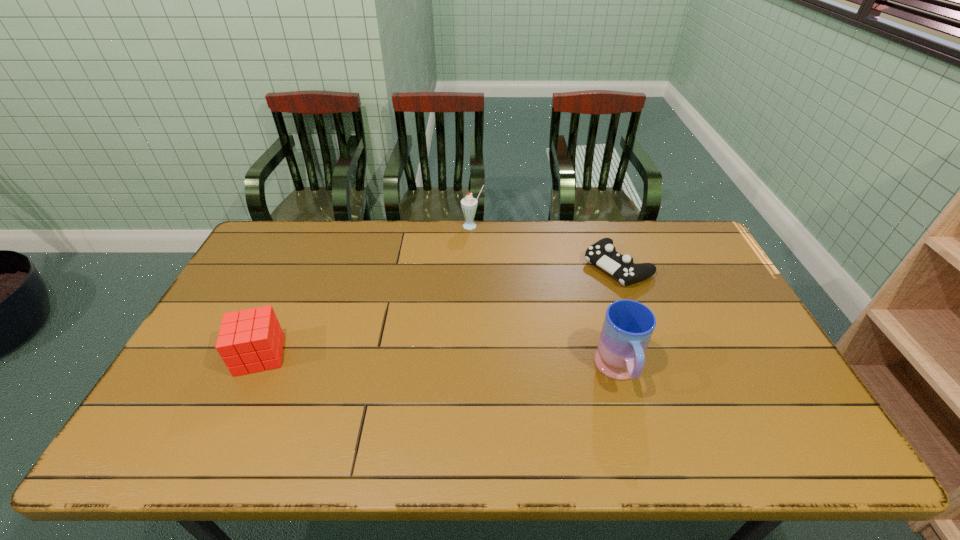
The width and height of the screenshot is (960, 540). I want to click on the leftmost object, so click(x=249, y=341).

What are the coordinates of `cube` in the screenshot? It's located at (249, 341).

Locate an element on the screen. mug is located at coordinates (628, 325).

The image size is (960, 540). In order to click on the shortest object in this screenshot , I will do 602,253.

What are the coordinates of `control` in the screenshot? It's located at (602, 253).

Where is `the farthest object`? the farthest object is located at coordinates (469, 204).

The height and width of the screenshot is (540, 960). Find the location of `milkshake`. milkshake is located at coordinates (469, 204).

This screenshot has height=540, width=960. I want to click on free location located 0.220m on the right of the cube, so click(367, 355).

This screenshot has height=540, width=960. In order to click on vacant area located 0.120m on the surface of the third nearest object in this screenshot , I will do `click(569, 296)`.

Image resolution: width=960 pixels, height=540 pixels. Find the location of `blank area located on the surface of the third nearest object`. blank area located on the surface of the third nearest object is located at coordinates (546, 311).